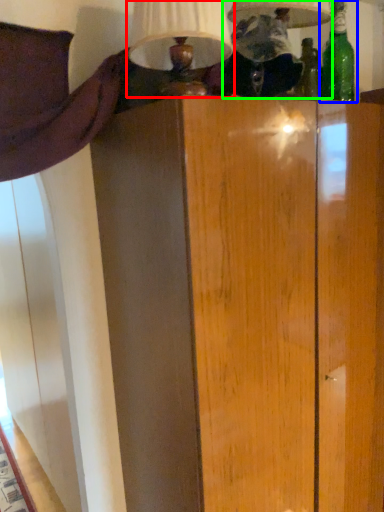
Question: Based on their relative distances, which object is farther from table lamp (highlighted by a red box)? Choose from bottle (highlighted by a blue box) and table lamp (highlighted by a green box).

Choices:
 (A) bottle
 (B) table lamp

Answer: (A)